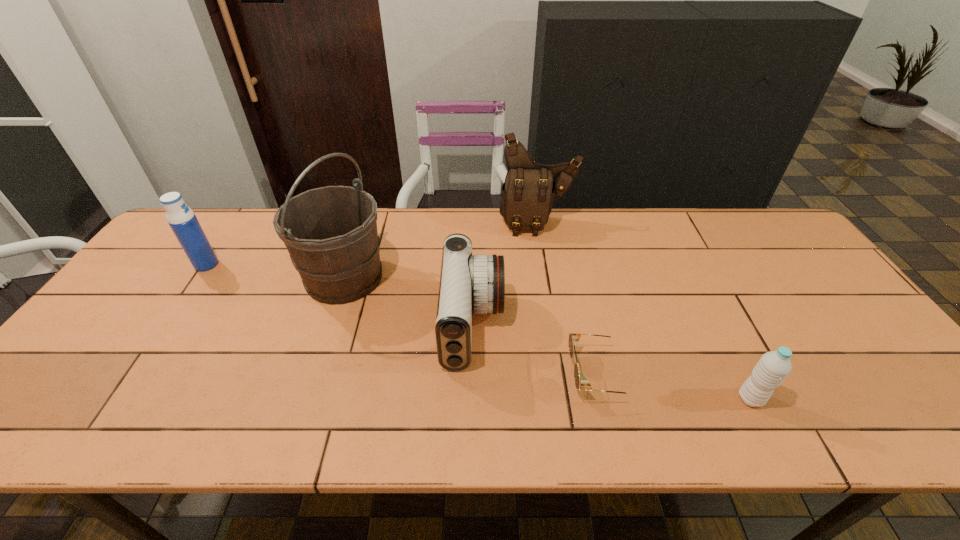
The height and width of the screenshot is (540, 960). I want to click on vacant area that lies between the nearer water bottle and the camcorder, so click(x=612, y=362).

Identify the location of free space between the bucket and the rightmost object. This screenshot has width=960, height=540. (547, 338).

At what (x,y) coordinates should I click in order to perform the action: click on free space between the shoulder bag and the camcorder. Please return your answer as a coordinate pair (x, y). This screenshot has height=540, width=960. Looking at the image, I should click on (505, 274).

Image resolution: width=960 pixels, height=540 pixels. What are the coordinates of `free space between the right water bottle and the fourth object from right to left` in the screenshot? It's located at (612, 362).

Locate an element on the screen. The height and width of the screenshot is (540, 960). vacant space that is in between the farthest object and the right water bottle is located at coordinates (644, 311).

Locate an element on the screen. This screenshot has height=540, width=960. free area in between the shortest object and the third object from left to right is located at coordinates (537, 349).

Identify which object is the fourth nearest to the left water bottle. Please provide its 2D coordinates. Your answer should be formatted as a tuple, i.e. [(x, y)], where the tuple contains the x and y coordinates of a point satisfying the conditions above.

[(573, 337)]

This screenshot has width=960, height=540. Identify the location of object that is the third closest to the second tallest object. click(x=573, y=337).

You are a GUI agent. You are given a task and a screenshot of the screen. Output one action in this format:
    pyautogui.click(x=<x>, y=<y>)
    Task: Click on the free spot that satisfies the following two spatial constraints: 1. on the front lenses of the sunglasses; 2. on the right side of the shorter water bottle
    
    Given the screenshot: What is the action you would take?
    pyautogui.click(x=606, y=399)

At what (x,y) coordinates should I click in order to perform the action: click on vacant area that satisfies the following two spatial constraints: 1. on the back side of the right water bottle; 2. on the front lenses of the sunglasses. Please return your answer as a coordinate pair (x, y). This screenshot has height=540, width=960. Looking at the image, I should click on (738, 374).